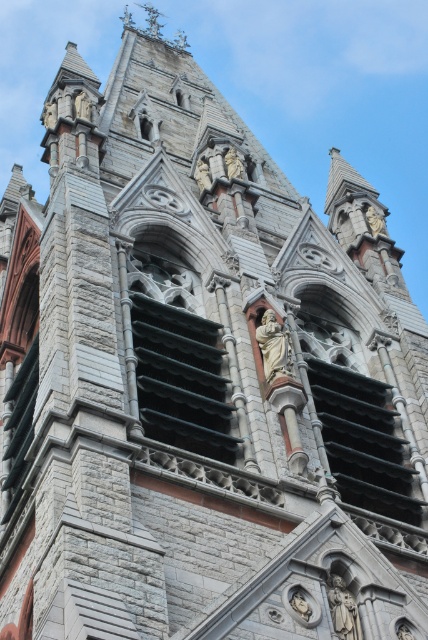
Question: Which point is closer to the camera taking this photo?

Choices:
 (A) (380, 214)
 (B) (350, 593)

Answer: (B)

Question: Does gold statue at upper right appear over gray stone statue at center?

Choices:
 (A) yes
 (B) no

Answer: (B)

Question: In this image, where is polished stone statue at center located relative to gold statue at upper right?

Choices:
 (A) right
 (B) left

Answer: (B)

Question: Among these points, which one is nearest to the camera?

Choices:
 (A) (265, 376)
 (B) (380, 216)

Answer: (A)

Question: Which point is closer to the camera?

Choices:
 (A) polished bronze statue at center
 (B) gold statue at upper right
 (C) gray stone statue at center
 (D) polished stone statue at center

Answer: (A)

Question: Is polished bronze statue at center to the left of gold statue at upper right from the viewer's perspective?

Choices:
 (A) yes
 (B) no

Answer: (A)